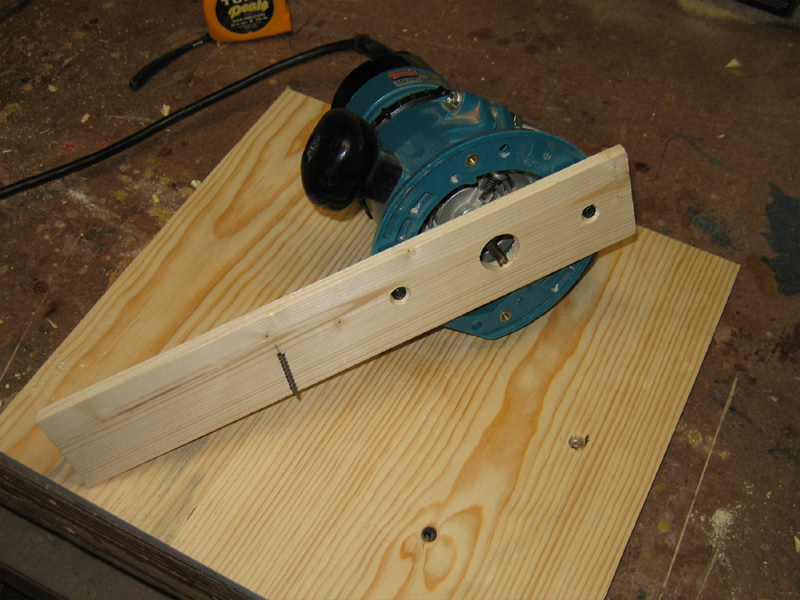
What are the coordinates of `wood base` in the screenshot? It's located at (450, 422).